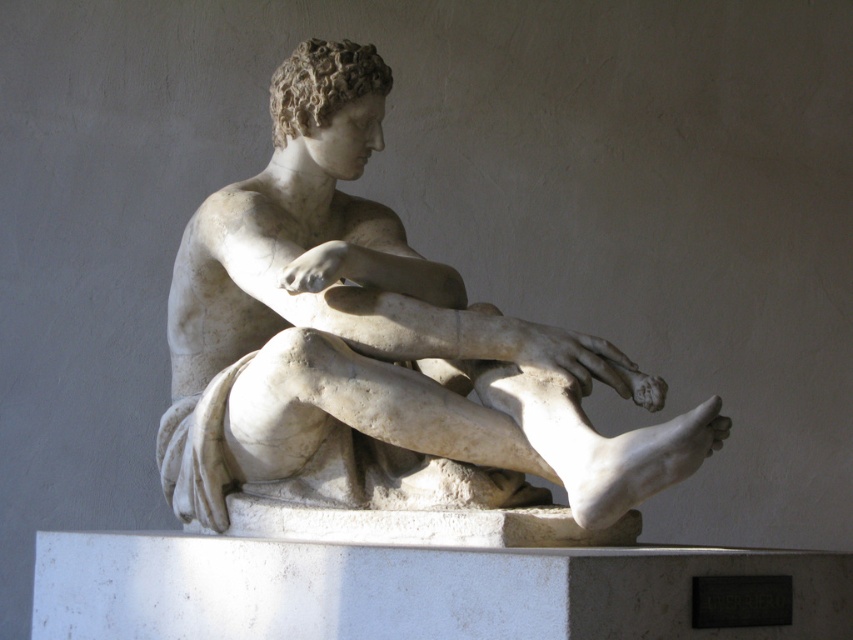
Based on the photo, is white marble statue at center closer to camera compared to white marble pillar at center?

No.

Can you confirm if white marble statue at center is shorter than white marble pillar at center?

Yes.

Does point (357, 355) come closer to viewer compared to point (106, 636)?

Yes.

Locate an element on the screen. The image size is (853, 640). white marble statue at center is located at coordinates (376, 348).